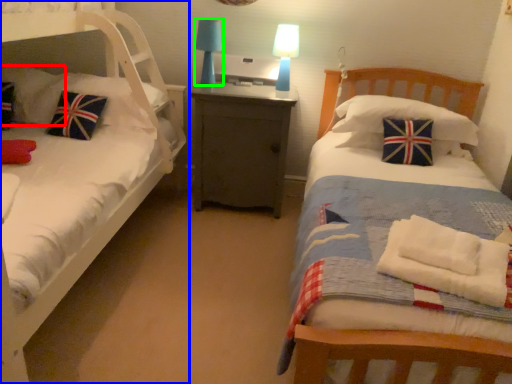
Question: Which object is the farthest from pillow (highlighted by a red box)? Choose among these: bed (highlighted by a blue box) or table lamp (highlighted by a green box).

Choices:
 (A) bed
 (B) table lamp

Answer: (B)